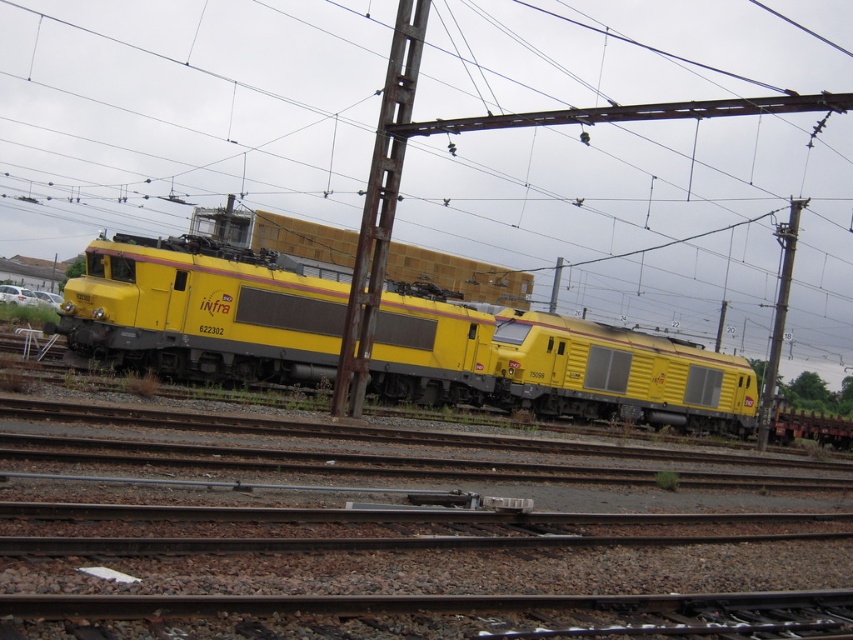
Does rusty metal pole at center have a smaller size compared to metallic pole at right?

Yes.

Which is behind, point (398, 74) or point (778, 237)?

The point (778, 237) is more distant.

The image size is (853, 640). Identify the location of rusty metal pole at center. (379, 205).

Does point (756, 392) come closer to viewer compared to point (357, 294)?

No, it is behind (357, 294).

This screenshot has width=853, height=640. Find the location of `yellow matte train car at center`. yellow matte train car at center is located at coordinates (619, 374).

Locate an element on the screen. The image size is (853, 640). yellow matte train car at center is located at coordinates (619, 374).

This screenshot has height=640, width=853. In order to click on yellow matte train car at center in this screenshot , I will do `click(619, 374)`.

Which is above, yellow matte train at center or yellow matte train car at center?

Positioned higher is yellow matte train at center.

Can you confirm if yellow matte train at center is shorter than yellow matte train car at center?

Incorrect, yellow matte train at center's height does not fall short of yellow matte train car at center's.

The height and width of the screenshot is (640, 853). What do you see at coordinates (552, 365) in the screenshot?
I see `yellow matte train at center` at bounding box center [552, 365].

The height and width of the screenshot is (640, 853). I want to click on yellow matte train at center, so click(x=552, y=365).